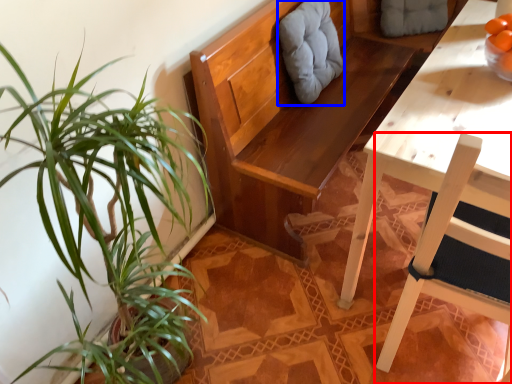
Question: Among these objects, which one is farthest to the camera, chair (highlighted by a red box) or swivel chair (highlighted by a blue box)?

Choices:
 (A) chair
 (B) swivel chair

Answer: (B)